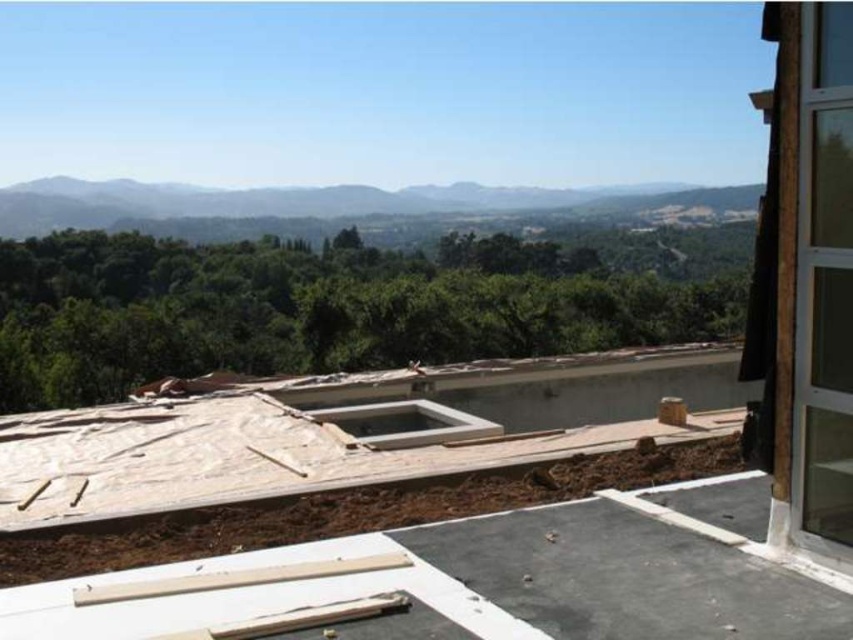
Question: Which of the following is the farthest from the observer?

Choices:
 (A) smooth concrete roof at center
 (B) wooden boards at center

Answer: (B)

Question: Which of the following is the closest to the observer?

Choices:
 (A) wooden boards at center
 (B) smooth concrete roof at center

Answer: (B)

Question: Observing the image, what is the correct spatial positioning of smooth concrete roof at center in reference to wooden boards at center?

Choices:
 (A) right
 (B) left

Answer: (A)

Question: Can you confirm if smooth concrete roof at center is wider than wooden boards at center?

Choices:
 (A) yes
 (B) no

Answer: (A)

Question: Does smooth concrete roof at center lie behind wooden boards at center?

Choices:
 (A) yes
 (B) no

Answer: (B)